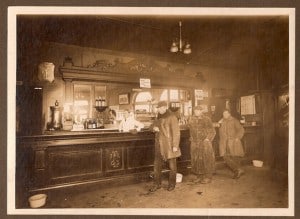
You are a GUI agent. You are given a task and a screenshot of the screen. Output one action in this format:
    pyautogui.click(x=<x>, y=<y>)
    Task: Click on the bar
    The image size is (300, 219).
    Given the screenshot: What is the action you would take?
    pyautogui.click(x=90, y=133)